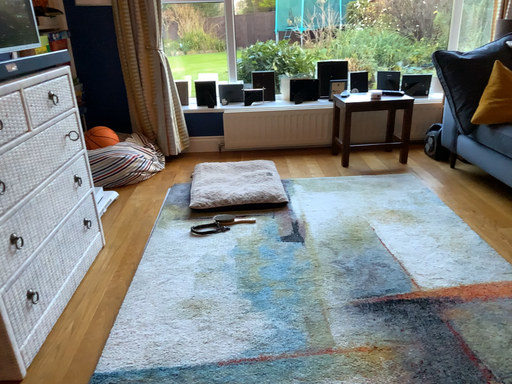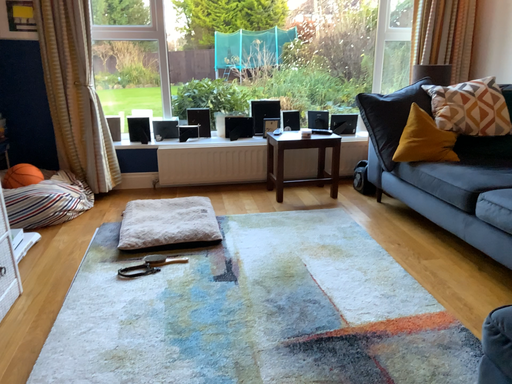
Question: How did the camera likely rotate when shooting the video?

Choices:
 (A) rotated right
 (B) rotated left

Answer: (A)